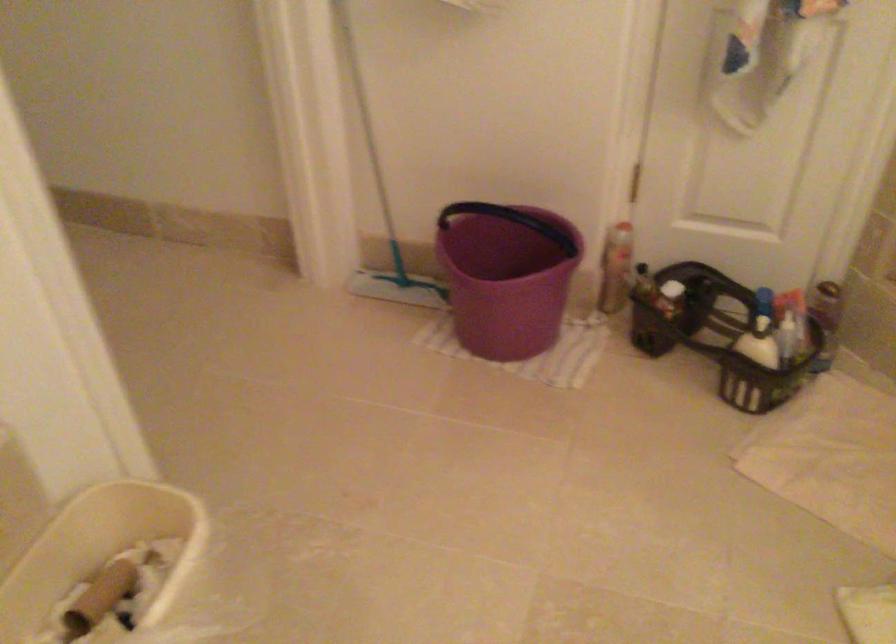
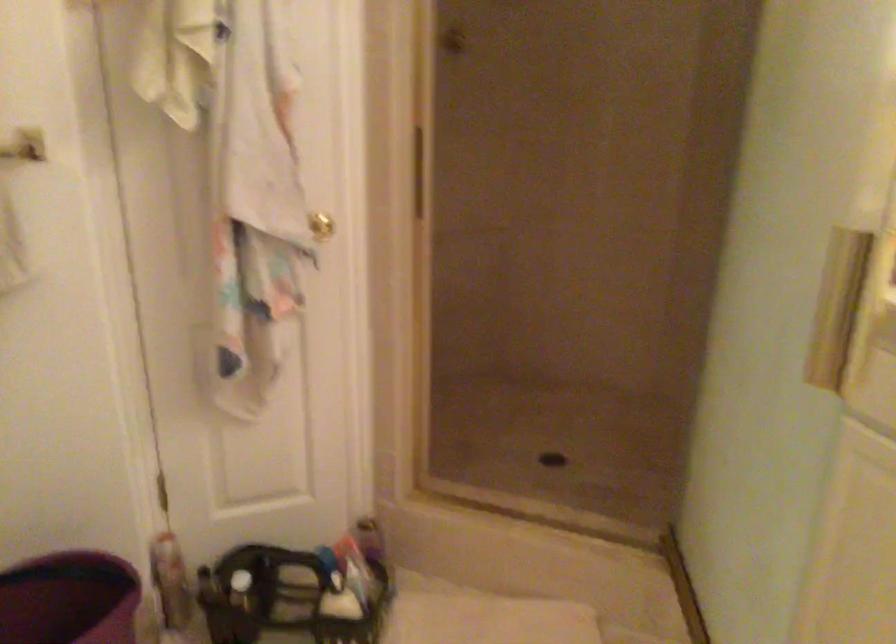
The point at (x=716, y=325) is marked in the first image. Where is the corresponding point in the second image?

(281, 598)